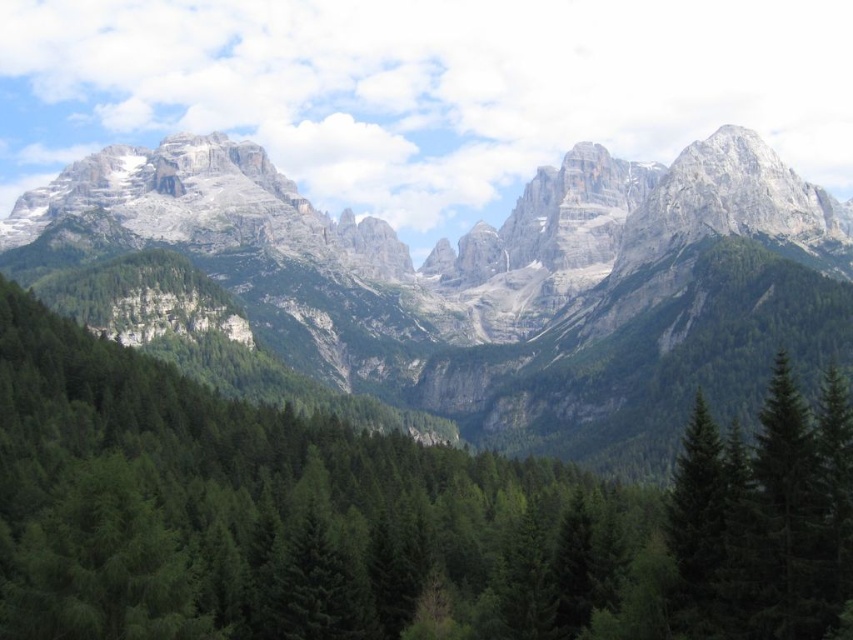
Between point (165, 570) and point (358, 257), which one is positioned behind?

The point (358, 257) is behind.

You are a GUI agent. You are given a task and a screenshot of the screen. Output one action in this format:
    pyautogui.click(x=<x>, y=<y>)
    Task: Click on the green matte tree at center
    
    Given the screenshot: What is the action you would take?
    pyautogui.click(x=387, y=516)